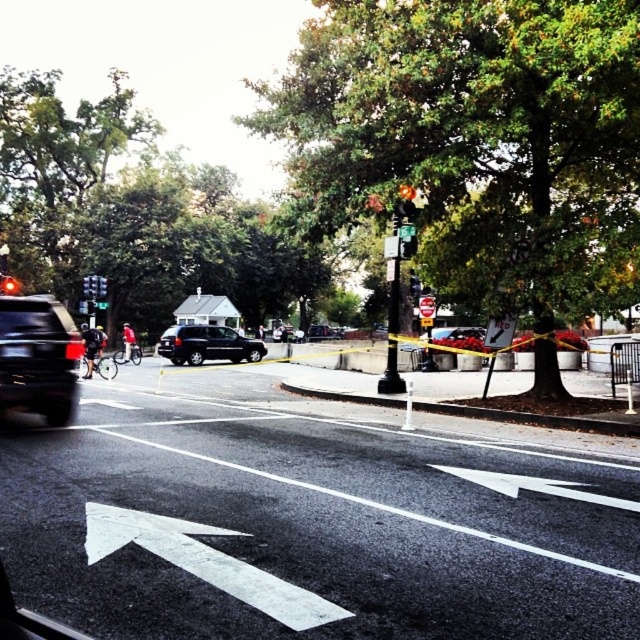
Which is below, matte black suv at left or metallic silver car at center?

metallic silver car at center is below.

Does matte black suv at left have a lesser height compared to metallic silver car at center?

No, matte black suv at left is not shorter than metallic silver car at center.

Locate an element on the screen. Image resolution: width=640 pixels, height=640 pixels. matte black suv at left is located at coordinates (38, 356).

Is black matte bicycle at left thinner than metallic silver car at center?

Incorrect, black matte bicycle at left's width is not less than metallic silver car at center's.

From the picture: Who is positioned more to the right, black matte bicycle at left or metallic silver car at center?

From the viewer's perspective, metallic silver car at center appears more on the right side.

The width and height of the screenshot is (640, 640). What are the coordinates of `black matte bicycle at left` in the screenshot? It's located at (93, 349).

Is metallic silver car at center bigger than red matte bicycle at left?

Actually, metallic silver car at center might be smaller than red matte bicycle at left.

Between point (451, 326) and point (124, 346), which one is positioned in front?

Point (124, 346) is more forward.

Locate an element on the screen. metallic silver car at center is located at coordinates (458, 337).